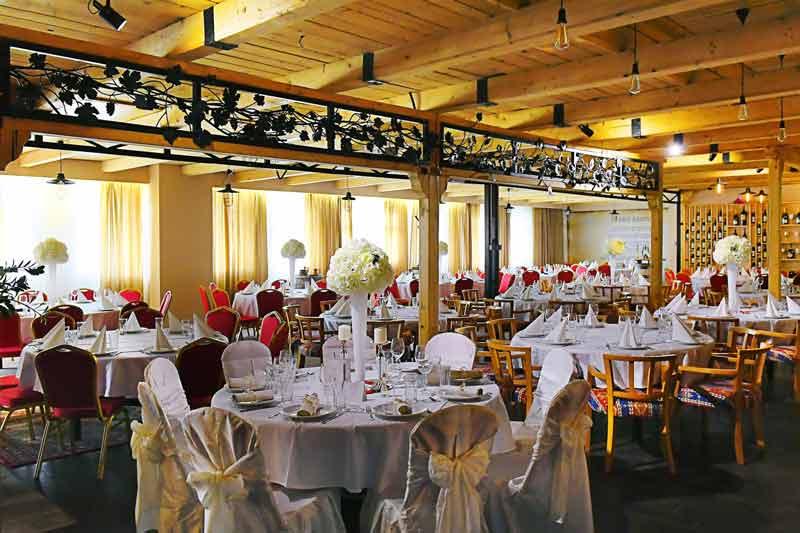
Image resolution: width=800 pixels, height=533 pixels. Find the location of `centerpieces`. centerpieces is located at coordinates (53, 256), (364, 271), (290, 247), (442, 250), (732, 248).